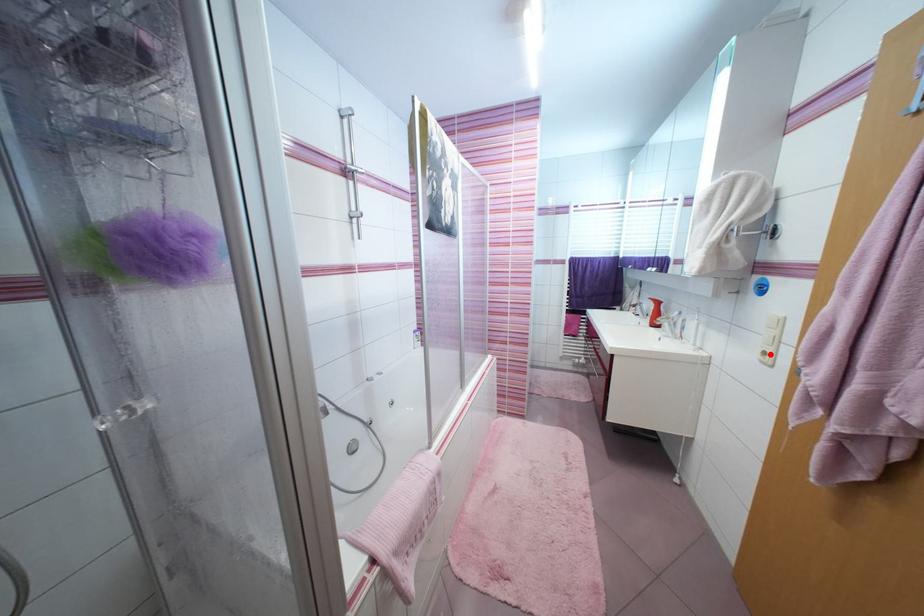
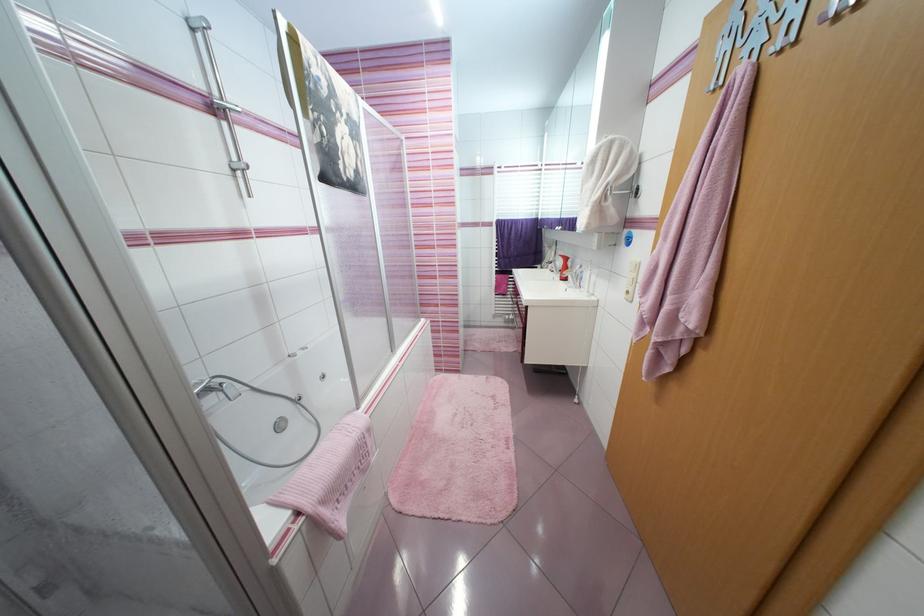
Where in the second image is the point corresponding to the highlighted location from the first image?

(633, 293)